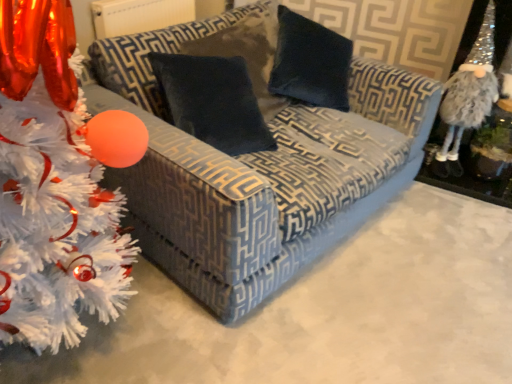
Question: In terms of size, does velvet-patterned couch at center appear bigger or smaller than fuzzy silver gnome at right?

Choices:
 (A) big
 (B) small

Answer: (A)

Question: Looking at their shapes, would you say velvet-patterned couch at center is wider or thinner than fuzzy silver gnome at right?

Choices:
 (A) thin
 (B) wide

Answer: (B)

Question: Which object is positioned closest to the velvet-patterned couch at center?

Choices:
 (A) velvet dark blue pillow at center
 (B) white fluffy christmas tree at left
 (C) fuzzy silver gnome at right

Answer: (A)

Question: Which object is positioned closest to the velvet dark blue pillow at center?

Choices:
 (A) velvet-patterned couch at center
 (B) white fluffy christmas tree at left
 (C) fuzzy silver gnome at right

Answer: (A)